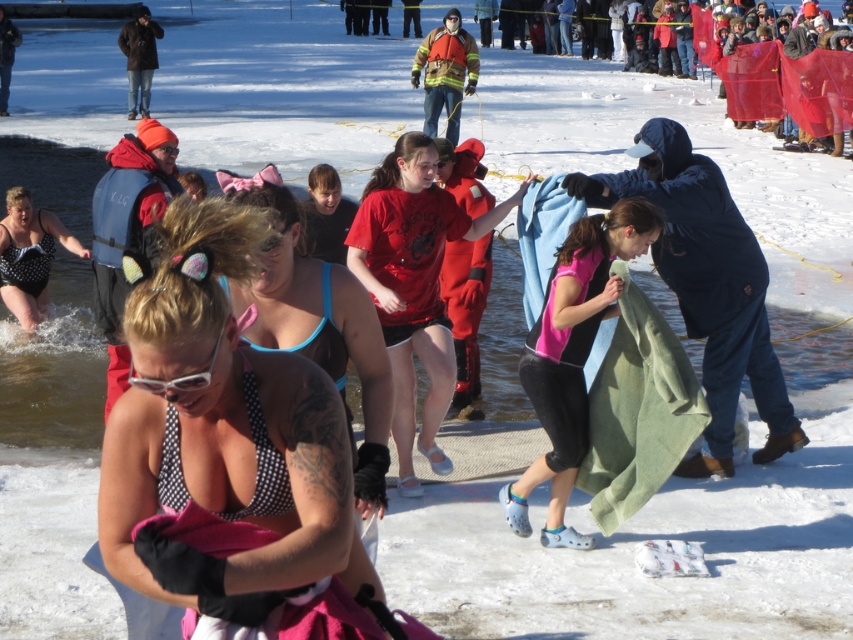
Question: Estimate the real-world distances between objects in this image. Which object is closer to the pink fleece blanket at center?

Choices:
 (A) blue fleece blanket at center
 (B) white matte goggles at center
 (C) blue bikini top at center

Answer: (A)

Question: Does pink polka dot bikini top at center have a larger size compared to red cotton shirt at center?

Choices:
 (A) no
 (B) yes

Answer: (A)

Question: Is pink polka dot bikini top at center smaller than pink fleece blanket at center?

Choices:
 (A) no
 (B) yes

Answer: (B)

Question: Can you confirm if pink fleece blanket at center is wider than white matte goggles at center?

Choices:
 (A) no
 (B) yes

Answer: (B)

Question: Which object is farther from the camera taking this photo?

Choices:
 (A) pink fleece blanket at center
 (B) matte black jacket at upper left
 (C) polka dot swimsuit at left

Answer: (B)

Question: Which point is farther to the camera?

Choices:
 (A) (376, 193)
 (B) (140, 108)
 (C) (6, 38)

Answer: (C)